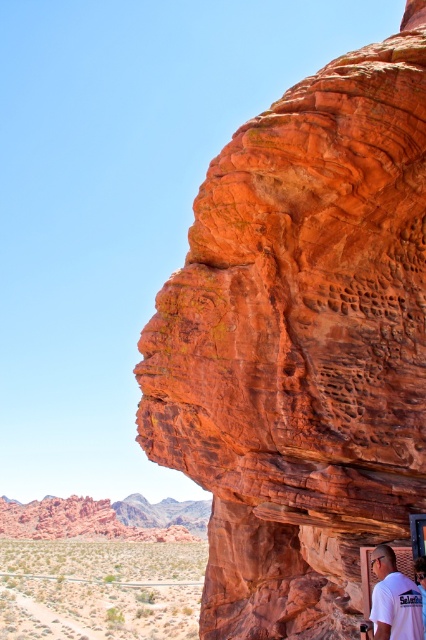
Between desertdry/dusty at lower left and white t-shirt at lower right, which one is positioned lower?

desertdry/dusty at lower left is below.

Does point (74, 604) come in front of point (382, 573)?

No, (74, 604) is behind (382, 573).

I want to click on desertdry/dusty at lower left, so click(x=100, y=589).

Is rustic sandstone face at right below white t-shirt at lower right?

Incorrect, rustic sandstone face at right is not positioned below white t-shirt at lower right.

At what (x,y) coordinates should I click in order to perform the action: click on rustic sandstone face at right. Please return your answer as a coordinate pair (x, y). This screenshot has height=640, width=426. Looking at the image, I should click on (302, 344).

Who is taller, rustic sandstone face at right or desertdry/dusty at lower left?

With more height is rustic sandstone face at right.

Does rustic sandstone face at right have a lesser width compared to desertdry/dusty at lower left?

Yes.

Who is more distant from viewer, (290, 464) or (14, 596)?

The point (14, 596) is behind.

I want to click on rustic sandstone face at right, so click(302, 344).